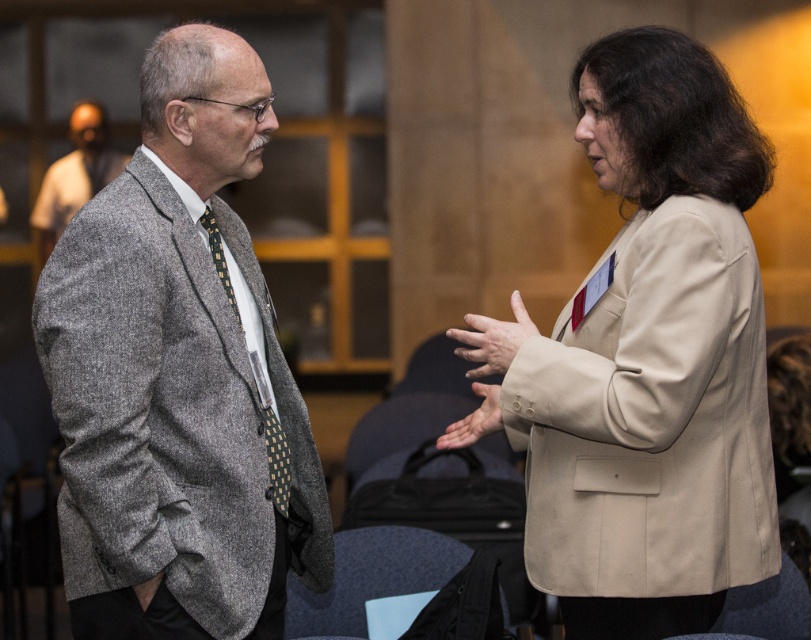
Question: Is gray wool suit at left to the right of beige fabric hand at center from the viewer's perspective?

Choices:
 (A) yes
 (B) no

Answer: (B)

Question: Which of the following is the closest to the observer?

Choices:
 (A) (483, 342)
 (B) (488, 406)
 (C) (67, 172)

Answer: (A)

Question: Can you confirm if gray woolen suit at left is positioned to the left of smooth beige hand at center?

Choices:
 (A) yes
 (B) no

Answer: (A)

Question: Estimate the real-world distances between objects in this image. Which object is farther from the beige fabric jacket at center?

Choices:
 (A) beige fabric hand at center
 (B) smooth beige hand at center

Answer: (A)

Question: Can you confirm if gray woolen suit at left is positioned above beige fabric hand at center?

Choices:
 (A) no
 (B) yes

Answer: (B)

Question: Which object is the closest to the beige fabric jacket at center?

Choices:
 (A) smooth beige hand at center
 (B) beige fabric hand at center
 (C) green dotted tie at center

Answer: (A)